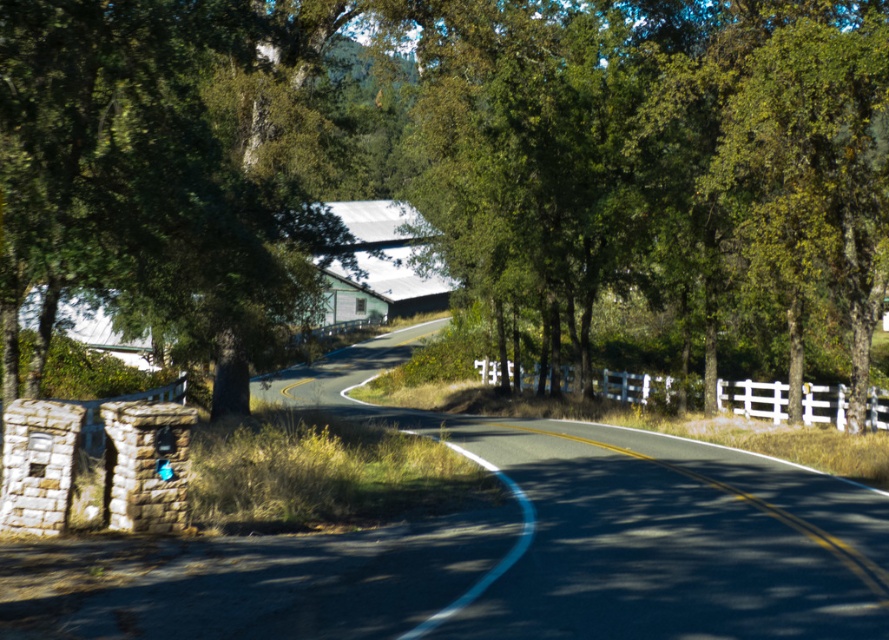
You are a gardener planning to plant a new row of flowers between the green leafy tree at center and the white wooden fence at center. The flowers require a minimum of 30 feet of space to grow properly. Based on the scene, will there be enough space for the flowers?

The distance between the green leafy tree at center and the white wooden fence at center is 32.21 feet, which exceeds the required 30 feet. Therefore, there is sufficient space to plant the flowers.

You are driving a truck that is 10 meters long and need to navigate around the green leafy tree at center and the white wooden fence at center. Which obstacle will require more space due to its size?

The green leafy tree at center is bigger than the white wooden fence at center, so it will require more space when navigating around it.

You are driving along the curving road and want to park near the green leafy tree at center and the white wooden fence at center. Which object should you approach first as you continue driving forward?

You should approach the green leafy tree at center first because it is closer to your current position compared to the white wooden fence at center.